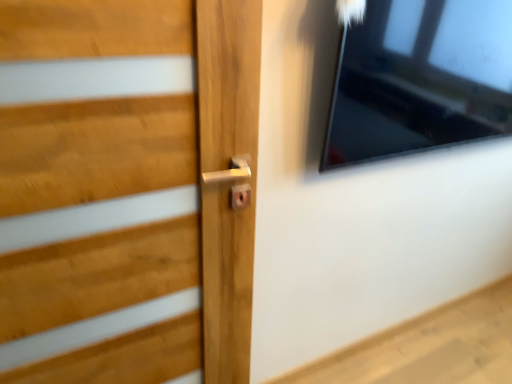
Question: Is wooden door handle at center inside or outside of transparent glass window at upper right?

Choices:
 (A) inside
 (B) outside

Answer: (B)

Question: Considering the relative positions of wooden door handle at center and transparent glass window at upper right in the image provided, is wooden door handle at center to the left or to the right of transparent glass window at upper right?

Choices:
 (A) left
 (B) right

Answer: (A)

Question: In terms of width, does wooden door handle at center look wider or thinner when compared to transparent glass window at upper right?

Choices:
 (A) wide
 (B) thin

Answer: (B)

Question: Considering the positions of transparent glass window at upper right and wooden door handle at center in the image, is transparent glass window at upper right bigger or smaller than wooden door handle at center?

Choices:
 (A) big
 (B) small

Answer: (A)

Question: From the image's perspective, is transparent glass window at upper right located above or below wooden door handle at center?

Choices:
 (A) below
 (B) above

Answer: (B)

Question: Considering the positions of transparent glass window at upper right and wooden door handle at center in the image, is transparent glass window at upper right wider or thinner than wooden door handle at center?

Choices:
 (A) thin
 (B) wide

Answer: (B)

Question: Which is correct: transparent glass window at upper right is inside wooden door handle at center, or outside of it?

Choices:
 (A) outside
 (B) inside

Answer: (A)